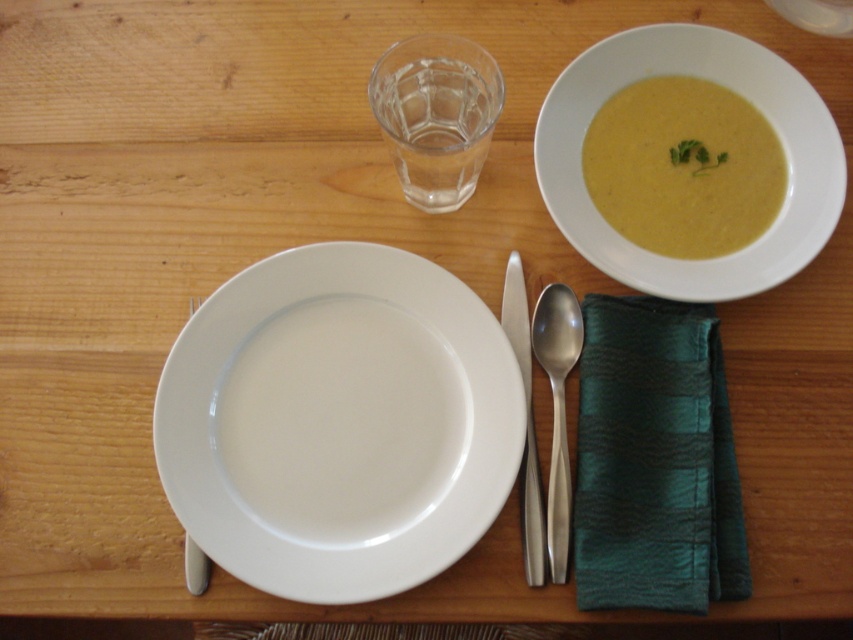
You are holding a 12 inch ruler and want to measure the distance from your eyes to the point at coordinates (762, 148) in the image. Based on the scene description, can your ruler reach that distance?

The point at coordinates (762, 148) is 19.19 inches away from the viewer. Since your ruler is only 12 inches long, it cannot reach that distance.